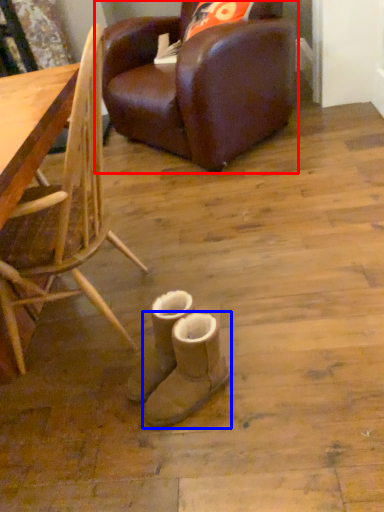
Question: Which of the following is the closest to the observer, chair (highlighted by a red box) or footwear (highlighted by a blue box)?

Choices:
 (A) chair
 (B) footwear

Answer: (B)